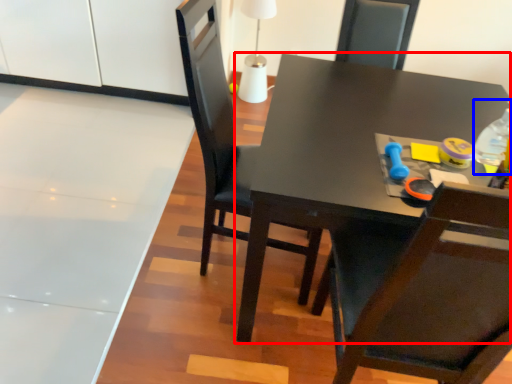
Question: Which of the following is the farthest to the observer, table (highlighted by a red box) or bottle (highlighted by a blue box)?

Choices:
 (A) table
 (B) bottle

Answer: (B)